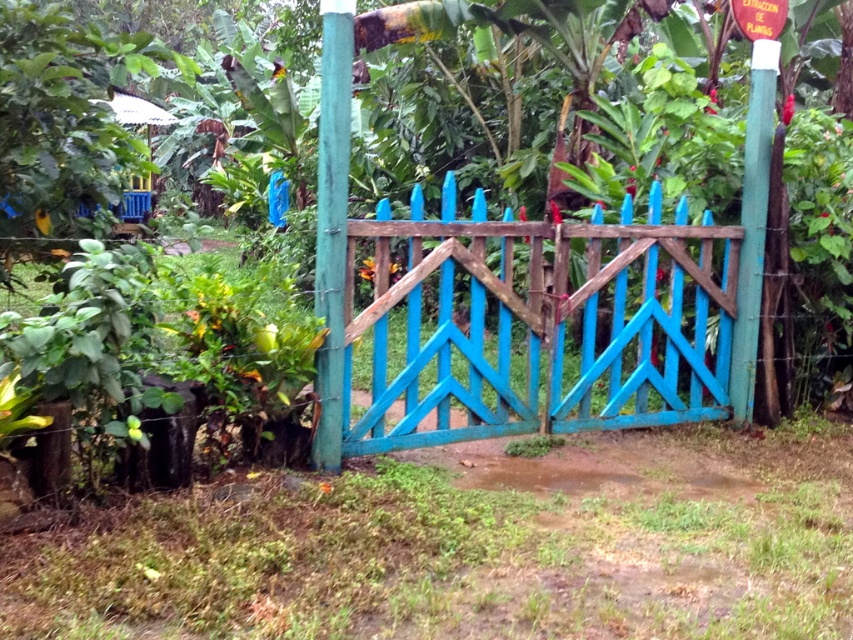
You are a visitor approaching the blue gate and notice two structures near it. One is the teal wood post at center and the other is the white painted wood pole at upper right. Which of these two structures is located to the left when facing the gate?

The teal wood post at center is positioned on the left side of the white painted wood pole at upper right, so when facing the gate, the teal wood post at center is on the left.

You are a delivery person approaching the blue painted wood gate at center. You notice the teal wood post at center nearby. Which object is closer to you as you approach the gate?

The blue painted wood gate at center is closer to you because the teal wood post at center is behind it.